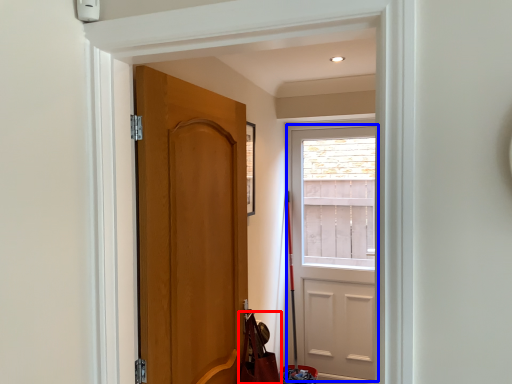
Question: Which object is closer to the camera taking this photo, shoulder bag (highlighted by a red box) or door (highlighted by a blue box)?

Choices:
 (A) shoulder bag
 (B) door

Answer: (A)